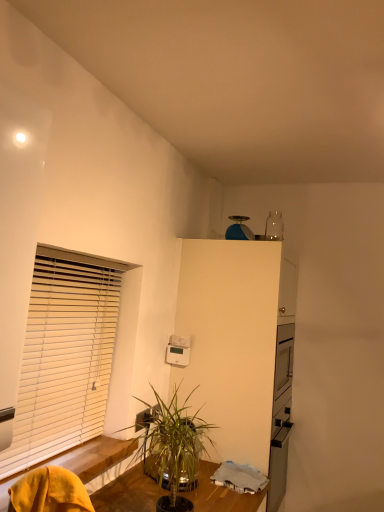
The height and width of the screenshot is (512, 384). Find the location of `white matte dresser at center`. white matte dresser at center is located at coordinates (240, 349).

What is the approximate height of white matte dresser at center?

white matte dresser at center is 1.66 meters tall.

Describe the element at coordinates (178, 351) in the screenshot. The image size is (384, 512). I see `white plastic thermostat at center, positioned as the 1th appliance in bottom-to-top order` at that location.

Describe the element at coordinates (239, 229) in the screenshot. I see `blue matte ball at upper center, which is counted as the first appliance, starting from the right` at that location.

Identify the location of yellow fabric swivel chair at lower left. This screenshot has height=512, width=384. (49, 492).

From a real-world perspective, which object rests below the other?

From a 3D spatial view, green leafy plant at lower center is below.

From the picture: Which object is thinner, green leafy plant at lower center or white matte dresser at center?

green leafy plant at lower center is thinner.

Which object is positioned more to the right, green leafy plant at lower center or white matte dresser at center?

white matte dresser at center.

Which object is further away from the camera taking this photo, green leafy plant at lower center or white matte dresser at center?

white matte dresser at center is more distant.

Is white matte dresser at center facing away from blue matte ball at upper center, arranged as the 2th appliance when ordered from the bottom?

No, white matte dresser at center is not facing the opposite direction of blue matte ball at upper center, arranged as the 2th appliance when ordered from the bottom.

Can you tell me how much white matte dresser at center and blue matte ball at upper center, arranged as the 2th appliance when ordered from the bottom, differ in facing direction?

0.00288 degrees.

Does white matte dresser at center contain blue matte ball at upper center, which is counted as the first appliance, starting from the right?

No, white matte dresser at center does not contain blue matte ball at upper center, which is counted as the first appliance, starting from the right.

Is point (241, 366) less distant than point (245, 216)?

That is True.

Is white matte dresser at center far away from green leafy plant at lower center?

No, there isn't a large distance between white matte dresser at center and green leafy plant at lower center.

Does white matte dresser at center have a lesser width compared to green leafy plant at lower center?

No.

Considering their positions, is white matte dresser at center located in front of or behind green leafy plant at lower center?

white matte dresser at center is positioned farther from the viewer than green leafy plant at lower center.

Can you confirm if white matte dresser at center is shorter than green leafy plant at lower center?

No.

From a real-world perspective, which is physically above, white plastic thermostat at center, the second appliance positioned from the top, or white wooden blinds at left?

white wooden blinds at left is physically above.

In the scene shown: Is white plastic thermostat at center, positioned as the 1th appliance in bottom-to-top order, bigger or smaller than white wooden blinds at left?

In the image, white plastic thermostat at center, positioned as the 1th appliance in bottom-to-top order, appears to be smaller than white wooden blinds at left.

From the picture: Between white plastic thermostat at center, positioned as the second appliance in right-to-left order, and white wooden blinds at left, which one has larger width?

Wider between the two is white wooden blinds at left.

How different are the orientations of white plastic thermostat at center, positioned as the second appliance in right-to-left order, and white wooden blinds at left in degrees?

90 degrees separate the facing orientations of white plastic thermostat at center, positioned as the second appliance in right-to-left order, and white wooden blinds at left.

Are white plastic thermostat at center, positioned as the second appliance in right-to-left order, and blue matte ball at upper center, marked as the second appliance in a left-to-right arrangement, far apart?

No, there isn't a large distance between white plastic thermostat at center, positioned as the second appliance in right-to-left order, and blue matte ball at upper center, marked as the second appliance in a left-to-right arrangement.

How many degrees apart are the facing directions of white plastic thermostat at center, positioned as the 1th appliance in bottom-to-top order, and blue matte ball at upper center, arranged as the 1th appliance when viewed from the top?

90 degrees separate the facing orientations of white plastic thermostat at center, positioned as the 1th appliance in bottom-to-top order, and blue matte ball at upper center, arranged as the 1th appliance when viewed from the top.

Based on the photo, can you confirm if white plastic thermostat at center, positioned as the second appliance in right-to-left order, is shorter than blue matte ball at upper center, arranged as the 2th appliance when ordered from the bottom?

Yes, white plastic thermostat at center, positioned as the second appliance in right-to-left order, is shorter than blue matte ball at upper center, arranged as the 2th appliance when ordered from the bottom.

Is green leafy plant at lower center with blue matte ball at upper center, arranged as the 1th appliance when viewed from the top?

No, green leafy plant at lower center is not next to blue matte ball at upper center, arranged as the 1th appliance when viewed from the top.

How much distance is there between green leafy plant at lower center and blue matte ball at upper center, arranged as the 1th appliance when viewed from the top?

green leafy plant at lower center and blue matte ball at upper center, arranged as the 1th appliance when viewed from the top, are 1.31 meters apart from each other.

Considering the relative sizes of green leafy plant at lower center and blue matte ball at upper center, which is counted as the first appliance, starting from the right, in the image provided, is green leafy plant at lower center shorter than blue matte ball at upper center, which is counted as the first appliance, starting from the right,?

No.

Which is closer to the camera, (164, 411) or (244, 232)?

Positioned in front is point (164, 411).

Is green leafy plant at lower center oriented away from yellow fabric swivel chair at lower left?

green leafy plant at lower center is not turned away from yellow fabric swivel chair at lower left.

From the image's perspective, does green leafy plant at lower center appear higher than yellow fabric swivel chair at lower left?

No, from the image's perspective, green leafy plant at lower center is not on top of yellow fabric swivel chair at lower left.

Where is `dresser above the green leafy plant at lower center (from a real-world perspective)`? dresser above the green leafy plant at lower center (from a real-world perspective) is located at coordinates (240, 349).

Where is `appliance lying on the right of white matte dresser at center`? This screenshot has height=512, width=384. appliance lying on the right of white matte dresser at center is located at coordinates (239, 229).

From the image, which object appears to be farther from blue matte ball at upper center, arranged as the 2th appliance when ordered from the bottom, white matte dresser at center or yellow fabric swivel chair at lower left?

The object further to blue matte ball at upper center, arranged as the 2th appliance when ordered from the bottom, is yellow fabric swivel chair at lower left.

Based on their spatial positions, is white matte dresser at center or white wooden blinds at left further from white plastic thermostat at center, positioned as the 1th appliance in bottom-to-top order?

white wooden blinds at left.

Looking at the image, which one is located closer to white wooden blinds at left, white plastic thermostat at center, the second appliance positioned from the top, or blue matte ball at upper center, which is counted as the first appliance, starting from the right?

white plastic thermostat at center, the second appliance positioned from the top, is positioned closer to the anchor white wooden blinds at left.

Based on their spatial positions, is blue matte ball at upper center, marked as the second appliance in a left-to-right arrangement, or white plastic thermostat at center, the second appliance positioned from the top, closer to white matte dresser at center?

white plastic thermostat at center, the second appliance positioned from the top, is positioned closer to the anchor white matte dresser at center.

When comparing their distances from white plastic thermostat at center, positioned as the 1th appliance in bottom-to-top order, does yellow fabric swivel chair at lower left or white wooden blinds at left seem closer?

The object closer to white plastic thermostat at center, positioned as the 1th appliance in bottom-to-top order, is white wooden blinds at left.

Estimate the real-world distances between objects in this image. Which object is further from yellow fabric swivel chair at lower left, green leafy plant at lower center or white plastic thermostat at center, which ranks as the 1th appliance in left-to-right order?

Among the two, white plastic thermostat at center, which ranks as the 1th appliance in left-to-right order, is located further to yellow fabric swivel chair at lower left.

Considering their positions, is blue matte ball at upper center, arranged as the 1th appliance when viewed from the top, positioned closer to green leafy plant at lower center than white plastic thermostat at center, the second appliance positioned from the top?

Based on the image, white plastic thermostat at center, the second appliance positioned from the top, appears to be nearer to green leafy plant at lower center.

From the image, which object appears to be farther from blue matte ball at upper center, arranged as the 2th appliance when ordered from the bottom, yellow fabric swivel chair at lower left or white plastic thermostat at center, which ranks as the 1th appliance in left-to-right order?

Result: yellow fabric swivel chair at lower left lies further to blue matte ball at upper center, arranged as the 2th appliance when ordered from the bottom, than the other object.

At what (x,y) coordinates should I click in order to perform the action: click on dresser between green leafy plant at lower center and white plastic thermostat at center, the second appliance positioned from the top, from front to back. Please return your answer as a coordinate pair (x, y). The width and height of the screenshot is (384, 512). Looking at the image, I should click on (240, 349).

Image resolution: width=384 pixels, height=512 pixels. Identify the location of appliance between blue matte ball at upper center, which is counted as the first appliance, starting from the right, and white matte dresser at center from top to bottom. (178, 351).

This screenshot has width=384, height=512. I want to click on window blind between yellow fabric swivel chair at lower left and blue matte ball at upper center, arranged as the 2th appliance when ordered from the bottom, in the front-back direction, so click(x=64, y=356).

This screenshot has width=384, height=512. I want to click on appliance between yellow fabric swivel chair at lower left and blue matte ball at upper center, marked as the second appliance in a left-to-right arrangement, in the front-back direction, so click(178, 351).